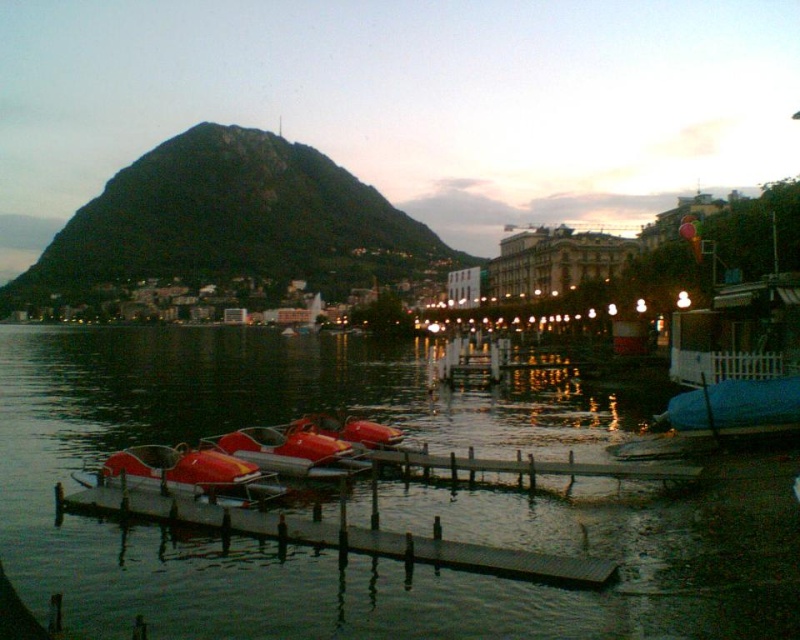
You are standing at the point marked by the coordinates point (338, 536). What object are you most likely standing on?

You are most likely standing on the smooth wooden dock at lower center, as the coordinates point (338, 536) represent the location of the smooth wooden dock at lower center.

You are standing on the smooth wooden dock at lower center and want to board the metallic red paddle boat at center. Which direction should you move to reach it?

Since the smooth wooden dock at lower center is in front of the metallic red paddle boat at center, you should move backward to reach the boat.